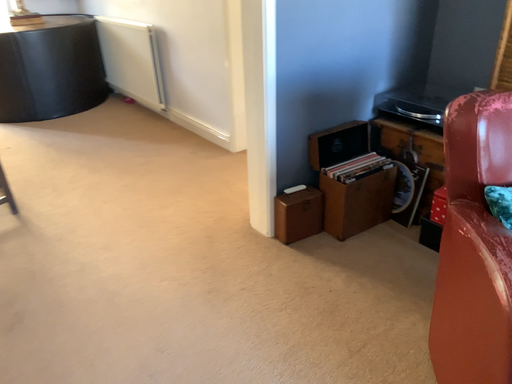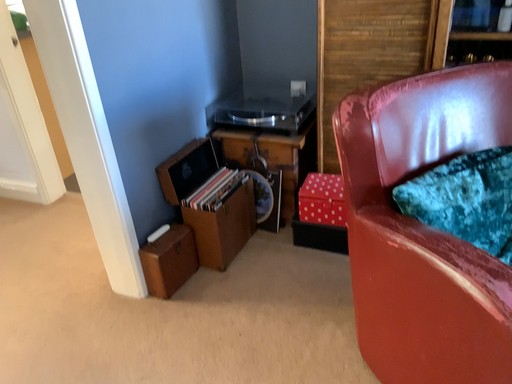
Question: Which way did the camera rotate in the video?

Choices:
 (A) rotated right
 (B) rotated left

Answer: (A)